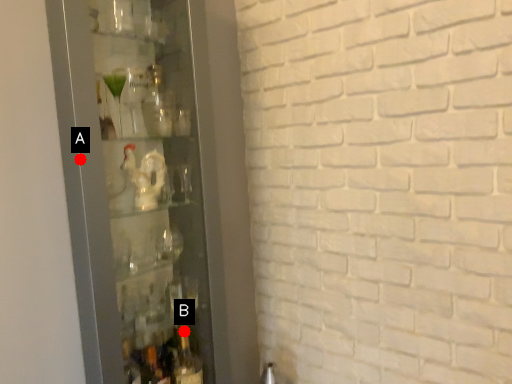
Question: Two points are circled on the image, labeled by A and B beside each circle. Which of the following is the closest to the observer?

Choices:
 (A) A is closer
 (B) B is closer

Answer: (A)